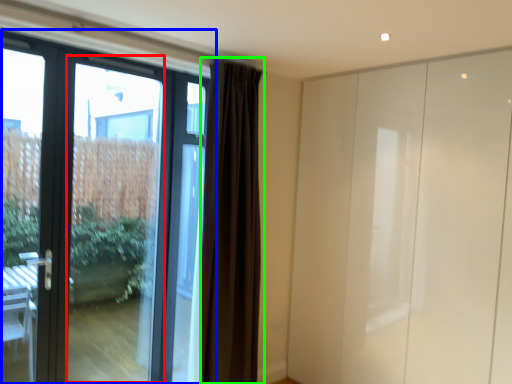
Question: Considering the real-world distances, which object is closest to glass door (highlighted by a red box)? door (highlighted by a blue box) or curtain (highlighted by a green box).

Choices:
 (A) door
 (B) curtain

Answer: (A)